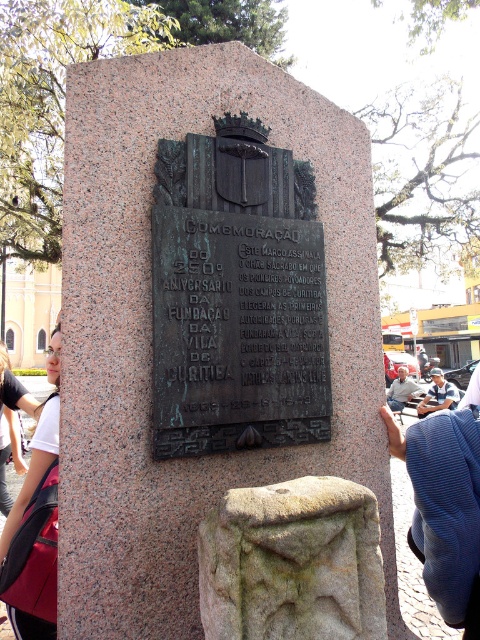
Which is above, gray rough stone at center or blue cotton shirt at center?

gray rough stone at center

Is point (288, 586) positioned before point (428, 403)?

Yes, it is in front of point (428, 403).

Where is `gray rough stone at center`? The image size is (480, 640). gray rough stone at center is located at coordinates (292, 563).

Does granite stone monument at center appear over bronze plaque at center?

No.

Between granite stone monument at center and bronze plaque at center, which one is positioned higher?

bronze plaque at center

Between point (168, 538) and point (237, 294), which one is positioned behind?

Point (237, 294)

What are the coordinates of `granite stone monument at center` in the screenshot? It's located at (149, 333).

Is granite stone monument at center taller than gray rough stone at center?

Yes, granite stone monument at center is taller than gray rough stone at center.

The height and width of the screenshot is (640, 480). Find the location of `granite stone monument at center`. granite stone monument at center is located at coordinates (149, 333).